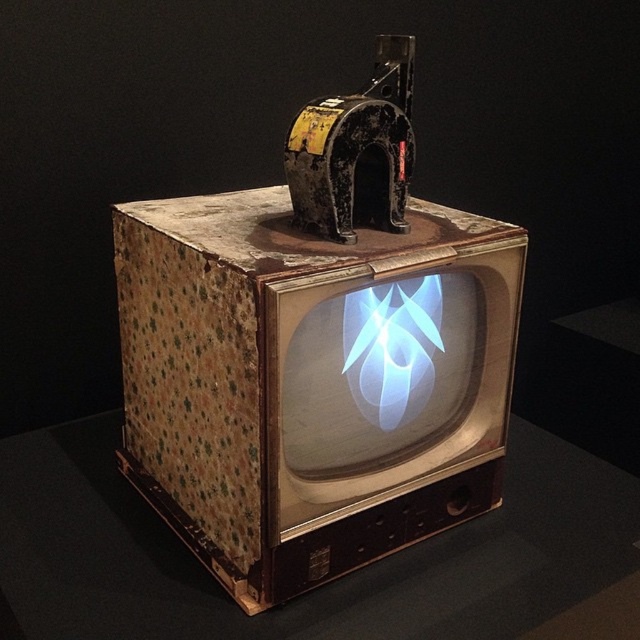
Which of these two, rusty cardboard box at center or wooden table at center, stands shorter?

wooden table at center is shorter.

Between rusty cardboard box at center and wooden table at center, which one is positioned higher?

rusty cardboard box at center is higher up.

Image resolution: width=640 pixels, height=640 pixels. Find the location of `rusty cardboard box at center`. rusty cardboard box at center is located at coordinates (310, 381).